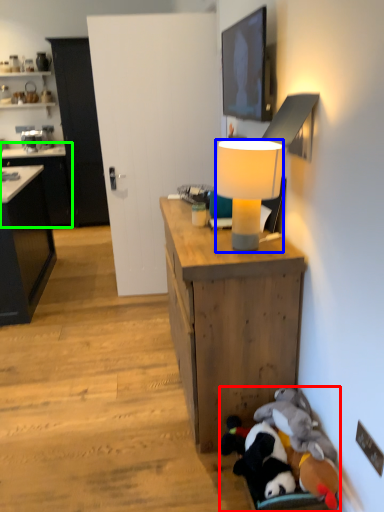
Question: Which object is the closest to the stuff (highlighted by a red box)? Choose among these: lamp (highlighted by a blue box) or cabinetry (highlighted by a green box).

Choices:
 (A) lamp
 (B) cabinetry

Answer: (A)